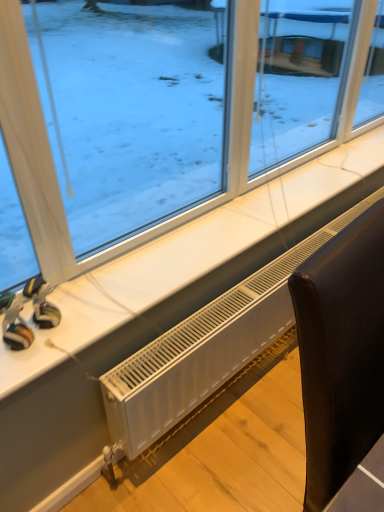
Question: Is white plastic radiator at lower center facing away from rubberized plastic toy at lower left, which is counted as the 1th toy, starting from the left?

Choices:
 (A) no
 (B) yes

Answer: (A)

Question: From a real-world perspective, is white plastic radiator at lower center physically below rubberized plastic toy at lower left, which is counted as the 1th toy, starting from the left?

Choices:
 (A) yes
 (B) no

Answer: (A)

Question: Is the position of white plastic radiator at lower center less distant than that of rubberized plastic toy at lower left, which is counted as the 1th toy, starting from the left?

Choices:
 (A) yes
 (B) no

Answer: (B)

Question: Does white plastic radiator at lower center have a greater width compared to rubberized plastic toy at lower left, which is counted as the 1th toy, starting from the left?

Choices:
 (A) no
 (B) yes

Answer: (B)

Question: Is white plastic radiator at lower center far from rubberized plastic toy at lower left, which is counted as the 1th toy, starting from the left?

Choices:
 (A) yes
 (B) no

Answer: (B)

Question: From the image's perspective, is rubberized plastic toy at lower left, which is counted as the 1th toy, starting from the left, positioned above or below transparent glass window at upper center?

Choices:
 (A) above
 (B) below

Answer: (B)

Question: Is point (8, 317) positioned closer to the camera than point (67, 169)?

Choices:
 (A) closer
 (B) farther

Answer: (A)

Question: Is rubberized plastic toy at lower left, which is counted as the 1th toy, starting from the left, taller or shorter than transparent glass window at upper center?

Choices:
 (A) tall
 (B) short

Answer: (B)

Question: From a real-world perspective, relative to transparent glass window at upper center, is rubberized plastic toy at lower left, the second toy in the right-to-left sequence, vertically above or below?

Choices:
 (A) above
 (B) below

Answer: (B)

Question: Would you say rubberized plastic toy at lower left, the second toy in the right-to-left sequence, is to the left or to the right of black leather chair at lower right in the picture?

Choices:
 (A) left
 (B) right

Answer: (A)

Question: In the image, is rubberized plastic toy at lower left, which is counted as the 1th toy, starting from the left, positioned in front of or behind black leather chair at lower right?

Choices:
 (A) behind
 (B) front

Answer: (A)

Question: In terms of height, does rubberized plastic toy at lower left, the second toy in the right-to-left sequence, look taller or shorter compared to black leather chair at lower right?

Choices:
 (A) short
 (B) tall

Answer: (A)

Question: Looking at the image, does rubberized plastic toy at lower left, the second toy in the right-to-left sequence, seem bigger or smaller compared to black leather chair at lower right?

Choices:
 (A) big
 (B) small

Answer: (B)

Question: Is black leather chair at lower right to the left or to the right of transparent glass window at upper center in the image?

Choices:
 (A) right
 (B) left

Answer: (A)

Question: From the image's perspective, is black leather chair at lower right positioned above or below transparent glass window at upper center?

Choices:
 (A) below
 (B) above

Answer: (A)